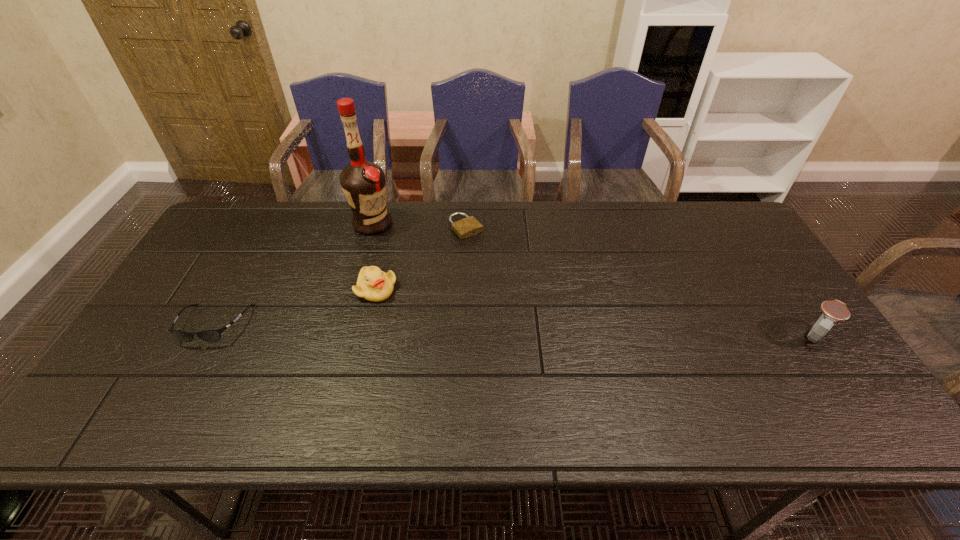
Image resolution: width=960 pixels, height=540 pixels. Identify the location of padlock positioned at the far edge. (469, 226).

What are the coordinates of `liquor at the far edge` in the screenshot? It's located at (363, 183).

The image size is (960, 540). In order to click on object at the left edge in this screenshot , I will do `click(213, 335)`.

You are a GUI agent. You are given a task and a screenshot of the screen. Output one action in this format:
    pyautogui.click(x=<x>, y=<y>)
    Task: Click on the object situated at the right edge
    
    Given the screenshot: What is the action you would take?
    pyautogui.click(x=834, y=311)

At what (x,y) coordinates should I click in order to perform the action: click on free space at the far edge of the desktop. Please return your answer as a coordinate pair (x, y). Looking at the image, I should click on (514, 233).

In the image, there is a desktop. Identify the location of vacant space at the near edge. (228, 372).

At what (x,y) coordinates should I click in order to perform the action: click on free space at the left edge of the desktop. Please return your answer as a coordinate pair (x, y). This screenshot has width=960, height=540. Looking at the image, I should click on (210, 299).

At what (x,y) coordinates should I click in order to perform the action: click on vacant area at the far left corner. Please return your answer as a coordinate pair (x, y). Looking at the image, I should click on (259, 205).

Locate an element on the screen. The height and width of the screenshot is (540, 960). free point at the far right corner is located at coordinates (717, 215).

Where is `empty space that is in between the shortest object and the third nearest object`? empty space that is in between the shortest object and the third nearest object is located at coordinates (421, 259).